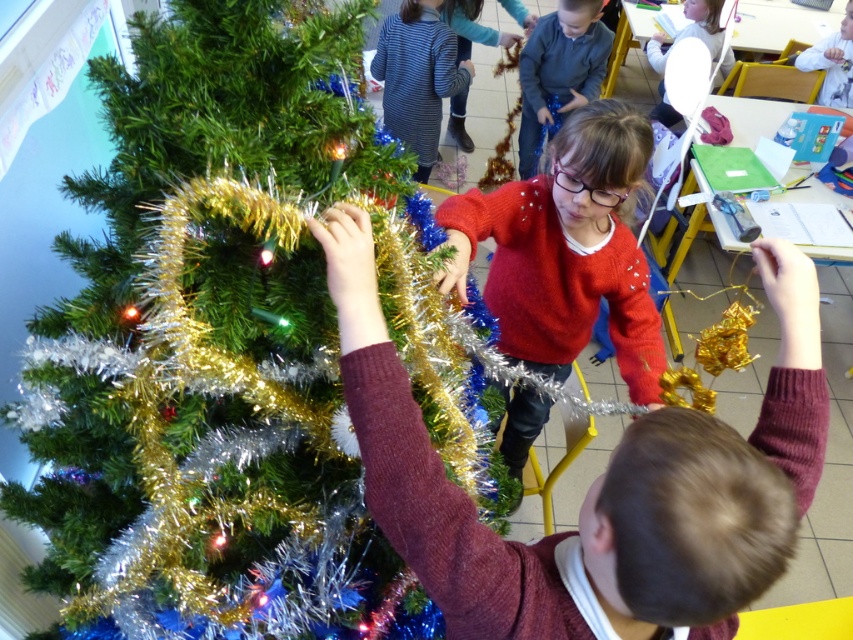
You are a parent observing the children decorating the Christmas tree. You notice two children wearing different colored sweaters. The one in the maroon sweater at center and the other in the gray wool sweater at upper center. Which child is positioned more to the left side of the scene?

The maroon sweater at center is to the left of the gray wool sweater at upper center, so the child in the maroon sweater at center is positioned more to the left side of the scene.

Based on the photo, where is the maroon sweater at center located in the image?

The maroon sweater at center is located at point (x=595, y=484) in the image.

You are a parent watching your children decorate the Christmas tree. You have a new decoration that is 30 inches long. Can you place it between the shiny metallic tinsel at center and the other object without overlapping?

The distance between the shiny metallic tinsel at center and the other object is 31.33 inches. Since the decoration is 30 inches long, it can fit between them without overlapping.